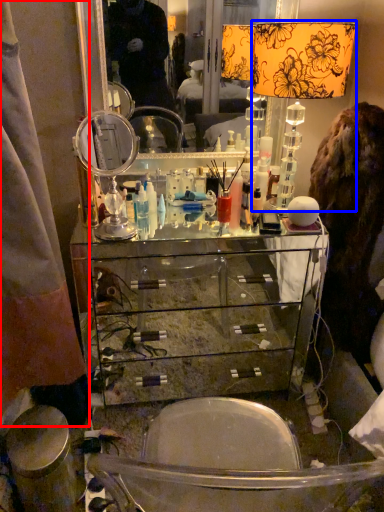
Question: Which point is closer to the camera, curtain (highlighted by a red box) or table lamp (highlighted by a blue box)?

Choices:
 (A) curtain
 (B) table lamp

Answer: (A)